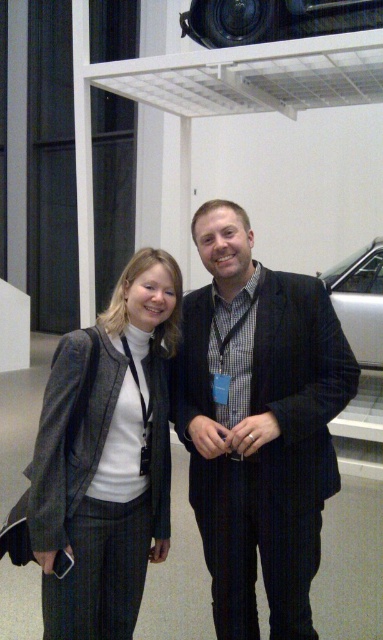
Is matte gray blazer at center in front of metallic silver car at upper center?

Yes, it is.

You are a GUI agent. You are given a task and a screenshot of the screen. Output one action in this format:
    pyautogui.click(x=<x>, y=<y>)
    Task: Click on the matte gray blazer at center
    This screenshot has height=640, width=383.
    Given the screenshot: What is the action you would take?
    [x=108, y=458]

Find the location of a particular element. Image resolution: width=383 pixels, height=640 pixels. matte gray blazer at center is located at coordinates [x=108, y=458].

Is dark pinstripe suit at center wider than metallic silver car at upper center?

No.

The width and height of the screenshot is (383, 640). In order to click on dark pinstripe suit at center in this screenshot , I will do `click(258, 422)`.

Who is shorter, matte gray blazer at center or silver metallic car at right?

Standing shorter between the two is matte gray blazer at center.

Is point (65, 483) closer to camera compared to point (335, 268)?

That is True.

The height and width of the screenshot is (640, 383). Identify the location of matte gray blazer at center. (108, 458).